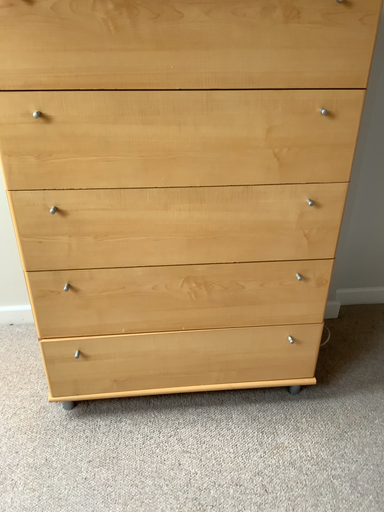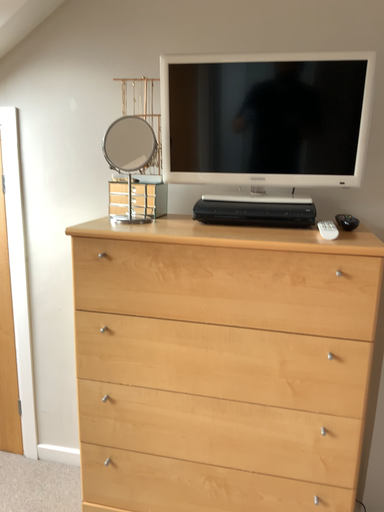
Question: Which way did the camera rotate in the video?

Choices:
 (A) rotated left
 (B) rotated right

Answer: (A)